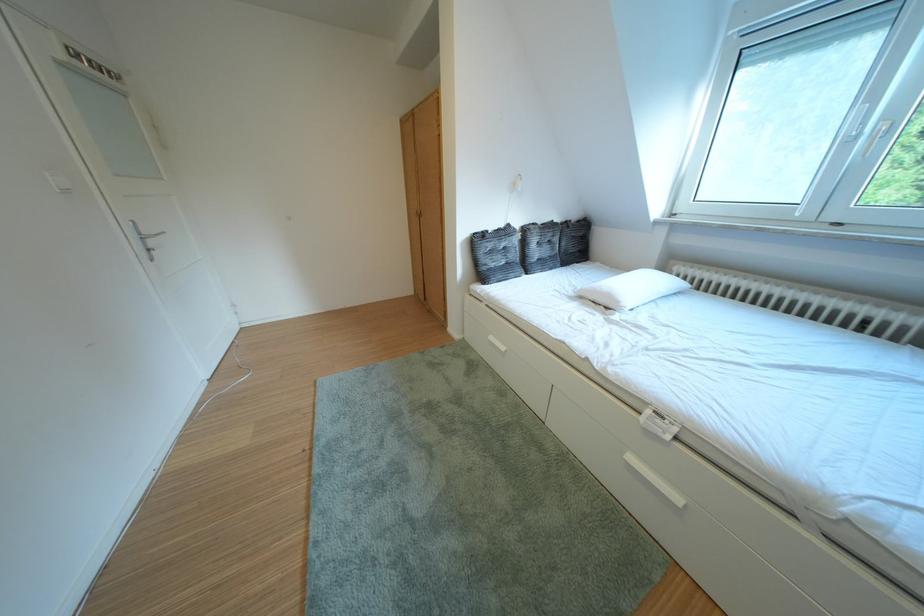
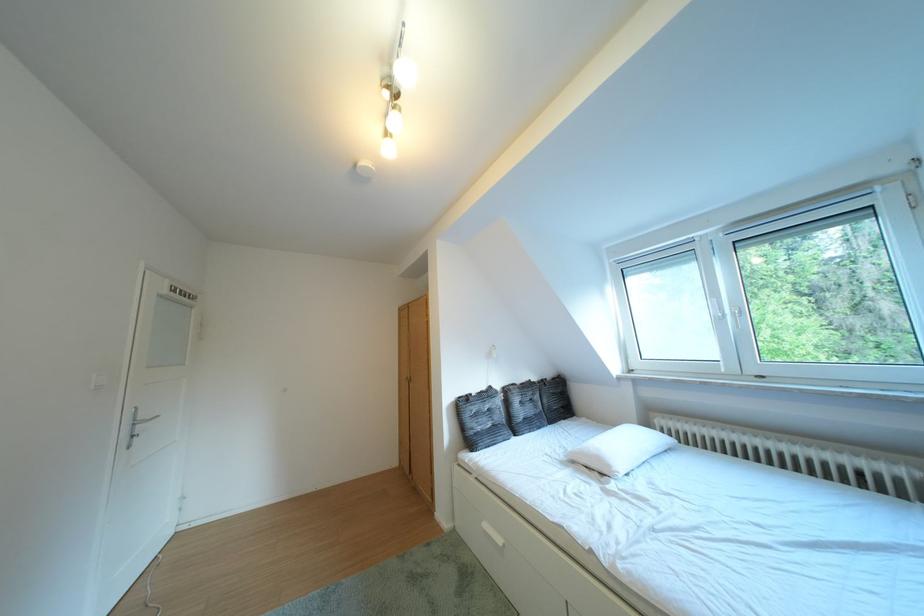
Where in the second image is the point corresponding to the point at 506,350 from the first image?

(503, 541)